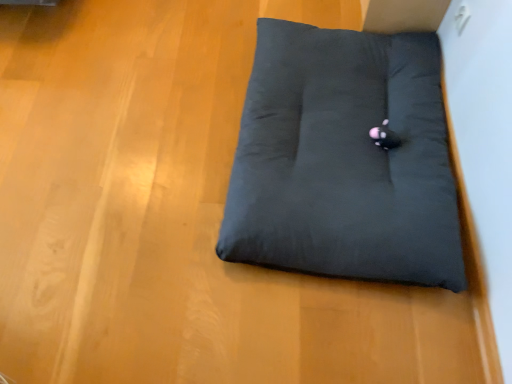
Describe the element at coordinates (344, 160) in the screenshot. I see `matte black pillow at center` at that location.

I want to click on matte black pillow at center, so click(344, 160).

Measure the distance between matte black pillow at center and camera.

3.71 feet.

Where is `matte black pillow at center`? Image resolution: width=512 pixels, height=384 pixels. matte black pillow at center is located at coordinates (344, 160).